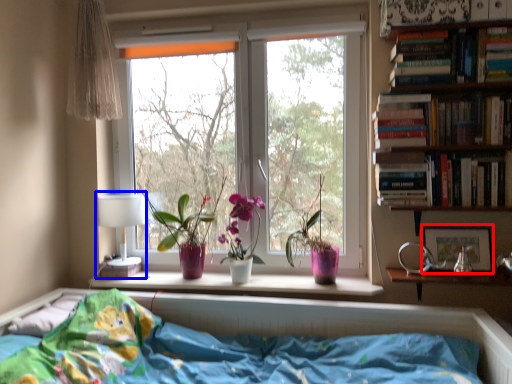
Question: Among these objects, which one is farthest to the camera, picture frame (highlighted by a red box) or table lamp (highlighted by a blue box)?

Choices:
 (A) picture frame
 (B) table lamp

Answer: (B)